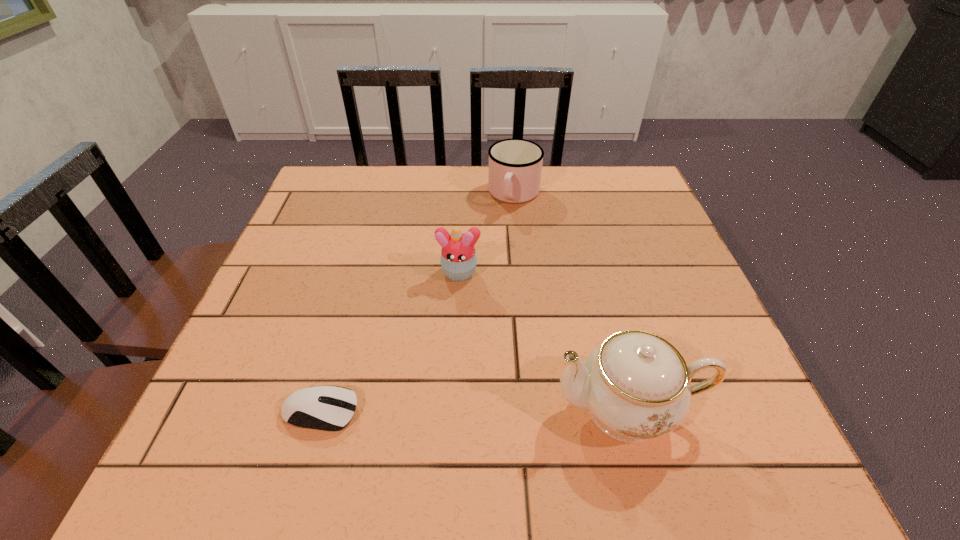
You are a GUI agent. You are given a task and a screenshot of the screen. Output one action in this format:
    pyautogui.click(x=<x>, y=<y>)
    Task: Click on the vacant space on the desktop that is between the leftmost object and the tallest object and is positioned on the side of the mug with the handle
    The height and width of the screenshot is (540, 960).
    Given the screenshot: What is the action you would take?
    pyautogui.click(x=437, y=410)

Image resolution: width=960 pixels, height=540 pixels. Identify the location of vacant space on the desktop that is between the mouse and the tallest object and is positioned on the face of the second object from left to right. (436, 410).